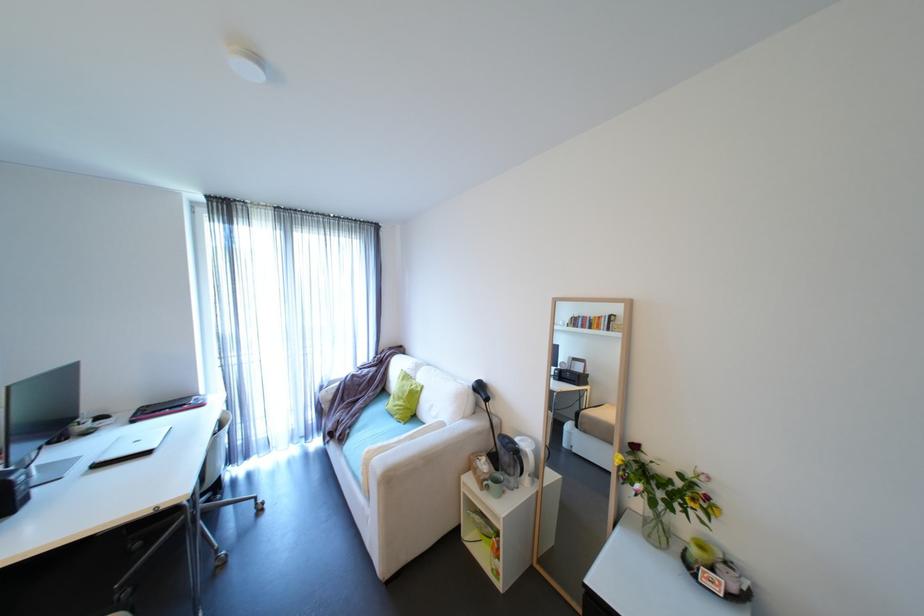
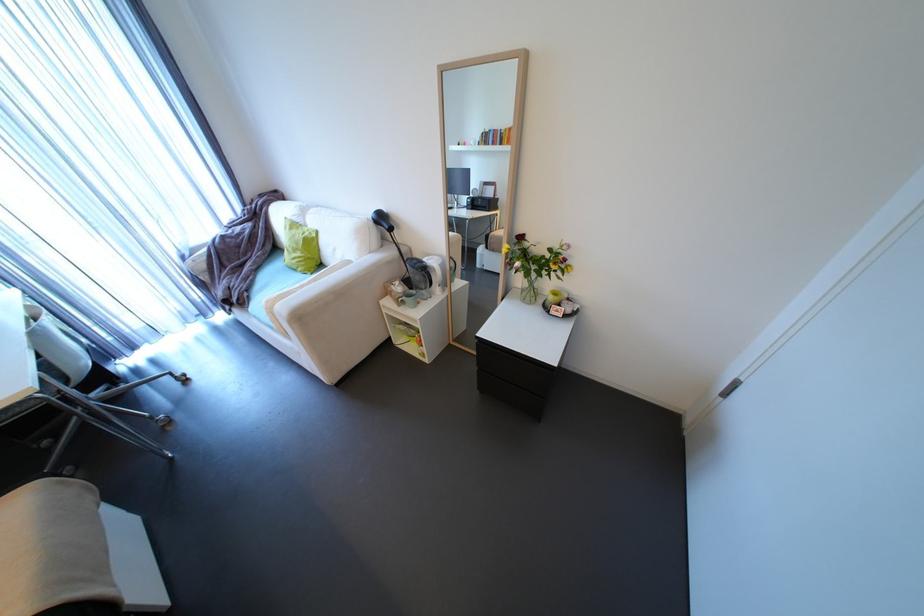
Locate, in the second image, the point that corresponds to the point at 505,469 in the first image.

(419, 289)